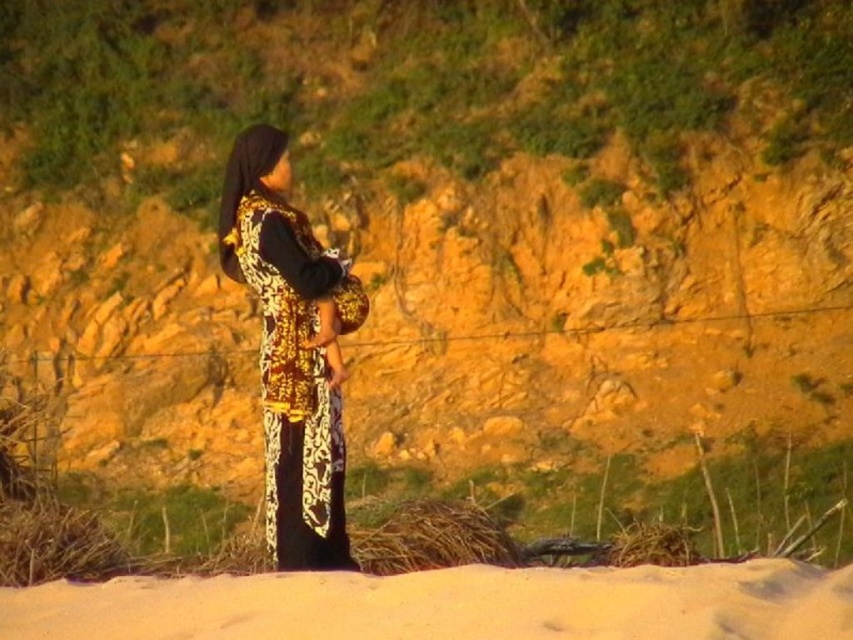
Question: Is sandy yellow sand at bottom above gold embroidered dress at center?

Choices:
 (A) no
 (B) yes

Answer: (A)

Question: Can you confirm if sandy yellow sand at bottom is positioned to the left of gold embroidered dress at center?

Choices:
 (A) yes
 (B) no

Answer: (B)

Question: Considering the relative positions of sandy yellow sand at bottom and gold embroidered dress at center in the image provided, where is sandy yellow sand at bottom located with respect to gold embroidered dress at center?

Choices:
 (A) below
 (B) above

Answer: (A)